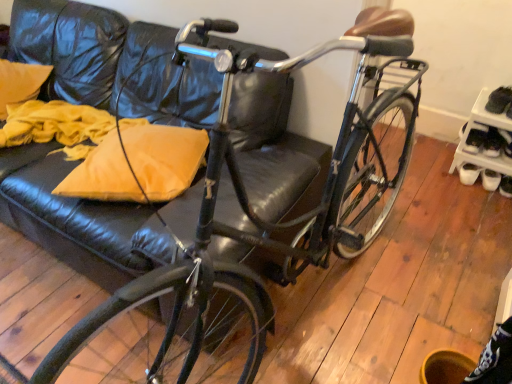
Describe the element at coordinates (506, 142) in the screenshot. I see `black leather shoe at right` at that location.

What is the approximate height of matte yellow pillow at left?

matte yellow pillow at left is 4.22 inches tall.

This screenshot has height=384, width=512. Find the location of `black leather shoe at lower right`. black leather shoe at lower right is located at coordinates (505, 186).

Locate an element on the screen. The height and width of the screenshot is (384, 512). black leather shoe at right is located at coordinates (506, 142).

You are a GUI agent. You are given a task and a screenshot of the screen. Output one action in this format:
    pyautogui.click(x=<x>, y=<y>)
    Task: Click on the shoe lying on the right of yellow fabric pillow at upper left
    
    Given the screenshot: What is the action you would take?
    (506, 142)

Between yellow fabric pillow at upper left and black leather shoe at right, which one has larger width?

yellow fabric pillow at upper left.

How different are the orientations of yellow fabric pillow at upper left and black leather shoe at right in degrees?

The facing directions of yellow fabric pillow at upper left and black leather shoe at right are 20.1 degrees apart.

Does white plastic shoe rack at right have a larger size compared to matte yellow pillow at left?

Correct, white plastic shoe rack at right is larger in size than matte yellow pillow at left.

Considering the sizes of objects white plastic shoe rack at right and matte yellow pillow at left in the image provided, who is wider, white plastic shoe rack at right or matte yellow pillow at left?

With larger width is matte yellow pillow at left.

From a real-world perspective, is black leather shoe at right physically located above or below yellow fabric pillow at upper left?

black leather shoe at right is situated lower than yellow fabric pillow at upper left in the real world.

Is black leather shoe at right far away from yellow fabric pillow at upper left?

Indeed, black leather shoe at right is not near yellow fabric pillow at upper left.

Do you think black leather shoe at right is within yellow fabric pillow at upper left, or outside of it?

black leather shoe at right is outside yellow fabric pillow at upper left.

Find the location of a particular element. The width and height of the screenshot is (512, 384). throw pillow positioned vertically above the black leather shoe at right (from a real-world perspective) is located at coordinates (138, 165).

Between matte yellow pillow at left and black leather shoe at right, which one has larger size?

With larger size is matte yellow pillow at left.

Which is in front, matte yellow pillow at left or black leather shoe at right?

matte yellow pillow at left is in front.

Which is closer, [153,128] or [501,132]?

Point [153,128] appears to be closer to the viewer than point [501,132].

Between matte yellow pillow at left and white plastic shoe rack at right, which one has smaller width?

white plastic shoe rack at right.

From the image's perspective, is matte yellow pillow at left under white plastic shoe rack at right?

Yes, from the image's perspective, matte yellow pillow at left is beneath white plastic shoe rack at right.

How far apart are matte yellow pillow at left and white plastic shoe rack at right?

matte yellow pillow at left and white plastic shoe rack at right are 1.61 meters apart from each other.

Locate an element on the screen. shelf below the yellow fabric pillow at upper left (from a real-world perspective) is located at coordinates (486, 140).

From a real-world perspective, who is located lower, white plastic shoe rack at right or yellow fabric pillow at upper left?

From a 3D spatial view, white plastic shoe rack at right is below.

Measure the distance between white plastic shoe rack at right and yellow fabric pillow at upper left.

The distance of white plastic shoe rack at right from yellow fabric pillow at upper left is 2.27 meters.

Are white plastic shoe rack at right and yellow fabric pillow at upper left making contact?

No, white plastic shoe rack at right is not making contact with yellow fabric pillow at upper left.

Is yellow fabric pillow at upper left spatially inside white plastic shoe rack at right, or outside of it?

yellow fabric pillow at upper left is not enclosed by white plastic shoe rack at right.

How many degrees apart are the facing directions of yellow fabric pillow at upper left and white plastic shoe rack at right?

There is a 20.2-degree angle between the facing directions of yellow fabric pillow at upper left and white plastic shoe rack at right.

Consider the image. Considering their positions, is yellow fabric pillow at upper left located in front of or behind white plastic shoe rack at right?

Visually, yellow fabric pillow at upper left is located in front of white plastic shoe rack at right.

Does yellow fabric pillow at upper left have a lesser width compared to white plastic shoe rack at right?

Incorrect, the width of yellow fabric pillow at upper left is not less than that of white plastic shoe rack at right.

Identify the location of pillow that appears above the black leather shoe at right (from a real-world perspective). This screenshot has width=512, height=384. (20, 83).

Find the location of a particular element. This screenshot has width=512, height=384. shelf above the matte yellow pillow at left (from the image's perspective) is located at coordinates click(x=486, y=140).

In the scene shown: From the image, which object appears to be farther from white plastic shoe rack at right, yellow fabric pillow at upper left or black leather shoe at right?

The object further to white plastic shoe rack at right is yellow fabric pillow at upper left.

Looking at the image, which one is located closer to white plastic shoe rack at right, matte yellow pillow at left or yellow fabric pillow at upper left?

matte yellow pillow at left.

Estimate the real-world distances between objects in this image. Which object is closer to white plastic shoe rack at right, yellow fabric pillow at upper left or matte yellow pillow at left?

Based on the image, matte yellow pillow at left appears to be nearer to white plastic shoe rack at right.

Looking at the image, which one is located closer to black leather shoe at right, matte yellow pillow at left or yellow fabric pillow at upper left?

matte yellow pillow at left is positioned closer to the anchor black leather shoe at right.

Based on their spatial positions, is yellow fabric pillow at upper left or black leather shoe at right closer to matte yellow pillow at left?

Among the two, yellow fabric pillow at upper left is located nearer to matte yellow pillow at left.

Looking at the image, which one is located further to white plastic shoe rack at right, black leather shoe at lower right or black leather shoe at right?

Based on the image, black leather shoe at lower right appears to be further to white plastic shoe rack at right.

Estimate the real-world distances between objects in this image. Which object is further from black leather shoe at right, black leather shoe at lower right or matte yellow pillow at left?

Among the two, matte yellow pillow at left is located further to black leather shoe at right.

Which object lies further to the anchor point black leather shoe at right, matte yellow pillow at left or black leather shoe at lower right?

Based on the image, matte yellow pillow at left appears to be further to black leather shoe at right.

Where is `shoe between yellow fabric pillow at upper left and black leather shoe at lower right from left to right`? This screenshot has height=384, width=512. shoe between yellow fabric pillow at upper left and black leather shoe at lower right from left to right is located at coordinates (506, 142).

Where is `shoe between white plastic shoe rack at right and black leather shoe at lower right vertically`? The width and height of the screenshot is (512, 384). shoe between white plastic shoe rack at right and black leather shoe at lower right vertically is located at coordinates [506, 142].

I want to click on throw pillow between yellow fabric pillow at upper left and black leather shoe at lower right, so click(138, 165).

The height and width of the screenshot is (384, 512). I want to click on shelf between matte yellow pillow at left and black leather shoe at right, so click(486, 140).